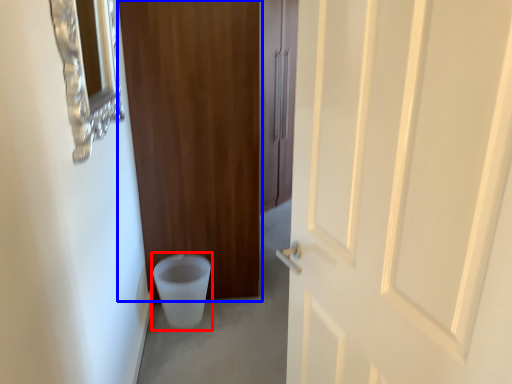
Question: Which object appears closest to the camera in this image, toilet bowl (highlighted by a red box) or door (highlighted by a blue box)?

Choices:
 (A) toilet bowl
 (B) door

Answer: (B)